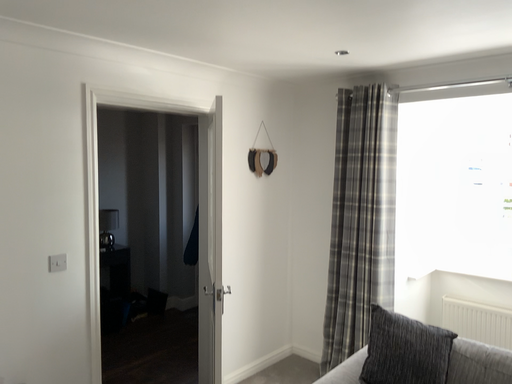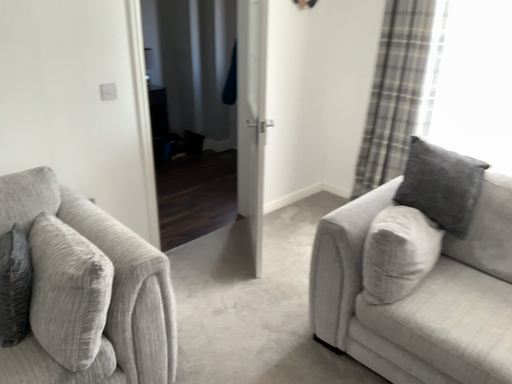
Question: How did the camera likely rotate when shooting the video?

Choices:
 (A) rotated downward
 (B) rotated upward

Answer: (A)